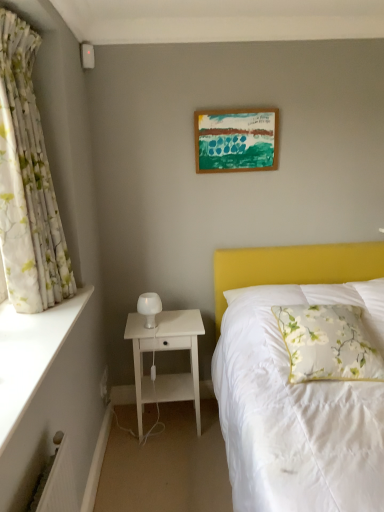
The height and width of the screenshot is (512, 384). Describe the element at coordinates (166, 350) in the screenshot. I see `white wood nightstand at lower left` at that location.

This screenshot has width=384, height=512. Identify the location of floral fabric pillow at right. (328, 343).

The image size is (384, 512). Identify the location of white floral fabric curtain at left. coord(27,182).

This screenshot has height=512, width=384. I want to click on ledge that appears above the white wood nightstand at lower left (from a real-world perspective), so click(30, 354).

Between white smooth ledge at left and white wood nightstand at lower left, which one has smaller size?

With smaller size is white smooth ledge at left.

In the image, is white smooth ledge at left positioned in front of or behind white wood nightstand at lower left?

white smooth ledge at left is in front of white wood nightstand at lower left.

Can you confirm if white smooth ledge at left is thinner than white wood nightstand at lower left?

Yes.

Is white frosted glass table lamp at left aimed at floral fabric pillow at right?

No, white frosted glass table lamp at left is not facing towards floral fabric pillow at right.

Is white frosted glass table lamp at left taller or shorter than floral fabric pillow at right?

In the image, white frosted glass table lamp at left appears to be shorter than floral fabric pillow at right.

Between white frosted glass table lamp at left and floral fabric pillow at right, which one appears on the right side from the viewer's perspective?

From the viewer's perspective, floral fabric pillow at right appears more on the right side.

Does point (140, 302) come farther from viewer compared to point (311, 374)?

That is True.

Is white floral fabric curtain at left oriented towards white smooth ledge at left?

No, white floral fabric curtain at left is not facing towards white smooth ledge at left.

Which object is further away from the camera, white floral fabric curtain at left or white smooth ledge at left?

Positioned behind is white floral fabric curtain at left.

From a real-world perspective, who is located lower, white floral fabric curtain at left or white smooth ledge at left?

white smooth ledge at left is physically lower.

Considering the positions of objects white floral fabric curtain at left and white smooth ledge at left in the image provided, who is more to the left, white floral fabric curtain at left or white smooth ledge at left?

white floral fabric curtain at left is more to the left.

Which object is closer to the camera taking this photo, white frosted glass table lamp at left or white wood nightstand at lower left?

white wood nightstand at lower left is closer to the camera.

Does point (146, 300) come farther from viewer compared to point (194, 380)?

No, it is in front of (194, 380).

Is white frosted glass table lamp at left spatially inside white wood nightstand at lower left, or outside of it?

white frosted glass table lamp at left is spatially situated outside white wood nightstand at lower left.

From a real-world perspective, who is located lower, white frosted glass table lamp at left or white wood nightstand at lower left?

white wood nightstand at lower left.

How distant is white frosted glass table lamp at left from white smooth ledge at left?

A distance of 32.56 inches exists between white frosted glass table lamp at left and white smooth ledge at left.

Consider the image. Considering the positions of objects white frosted glass table lamp at left and white smooth ledge at left in the image provided, who is in front, white frosted glass table lamp at left or white smooth ledge at left?

white smooth ledge at left.

Which is correct: white frosted glass table lamp at left is inside white smooth ledge at left, or outside of it?

white frosted glass table lamp at left is located beyond the bounds of white smooth ledge at left.

Is the depth of white smooth ledge at left less than that of wooden picture frame at upper center?

Yes, white smooth ledge at left is in front of wooden picture frame at upper center.

At what (x,y) coordinates should I click in order to perform the action: click on ledge below the wooden picture frame at upper center (from the image's perspective). Please return your answer as a coordinate pair (x, y). The width and height of the screenshot is (384, 512). Looking at the image, I should click on (30, 354).

Is white smooth ledge at left aimed at wooden picture frame at upper center?

No, white smooth ledge at left is not turned towards wooden picture frame at upper center.

Is wooden picture frame at upper center surrounded by white smooth ledge at left?

Actually, wooden picture frame at upper center is outside white smooth ledge at left.

Is white wood nightstand at lower left at the right side of white floral fabric curtain at left?

Indeed, white wood nightstand at lower left is positioned on the right side of white floral fabric curtain at left.

In the scene shown: Could you tell me if white wood nightstand at lower left is turned towards white floral fabric curtain at left?

No, white wood nightstand at lower left is not turned towards white floral fabric curtain at left.

Does white wood nightstand at lower left come behind white floral fabric curtain at left?

That is True.

Based on the photo, from the image's perspective, between white wood nightstand at lower left and white floral fabric curtain at left, who is located below?

white wood nightstand at lower left is shown below in the image.

Identify the location of ledge that is above the white wood nightstand at lower left (from a real-world perspective). (30, 354).

Image resolution: width=384 pixels, height=512 pixels. I want to click on pillow to the right of white frosted glass table lamp at left, so click(x=328, y=343).

Based on the photo, which object lies further to the anchor point white wood nightstand at lower left, white floral fabric curtain at left or white frosted glass table lamp at left?

Among the two, white floral fabric curtain at left is located further to white wood nightstand at lower left.

Consider the image. Estimate the real-world distances between objects in this image. Which object is further from white frosted glass table lamp at left, white smooth ledge at left or white wood nightstand at lower left?

Based on the image, white smooth ledge at left appears to be further to white frosted glass table lamp at left.

When comparing their distances from white wood nightstand at lower left, does floral fabric pillow at right or white frosted glass table lamp at left seem closer?

white frosted glass table lamp at left lies closer to white wood nightstand at lower left than the other object.

Estimate the real-world distances between objects in this image. Which object is closer to wooden picture frame at upper center, white frosted glass table lamp at left or white smooth ledge at left?

Among the two, white frosted glass table lamp at left is located nearer to wooden picture frame at upper center.

Based on the photo, considering their positions, is white smooth ledge at left positioned further to white wood nightstand at lower left than white floral fabric curtain at left?

white floral fabric curtain at left.

From the image, which object appears to be nearer to white frosted glass table lamp at left, white wood nightstand at lower left or floral fabric pillow at right?

Among the two, white wood nightstand at lower left is located nearer to white frosted glass table lamp at left.

Estimate the real-world distances between objects in this image. Which object is further from white smooth ledge at left, floral fabric pillow at right or white wood nightstand at lower left?

Result: floral fabric pillow at right is positioned further to the anchor white smooth ledge at left.

Estimate the real-world distances between objects in this image. Which object is closer to wooden picture frame at upper center, white frosted glass table lamp at left or white wood nightstand at lower left?

Among the two, white frosted glass table lamp at left is located nearer to wooden picture frame at upper center.

Find the location of a particular element. The height and width of the screenshot is (512, 384). curtain between wooden picture frame at upper center and white wood nightstand at lower left in the vertical direction is located at coordinates (27, 182).

Where is `table lamp between white smooth ledge at left and wooden picture frame at upper center in the front-back direction`? table lamp between white smooth ledge at left and wooden picture frame at upper center in the front-back direction is located at coordinates (149, 307).

The height and width of the screenshot is (512, 384). Find the location of `curtain positioned between white smooth ledge at left and white wood nightstand at lower left from near to far`. curtain positioned between white smooth ledge at left and white wood nightstand at lower left from near to far is located at coordinates (27, 182).

Where is `nightstand located between white smooth ledge at left and white frosted glass table lamp at left in the depth direction`? This screenshot has height=512, width=384. nightstand located between white smooth ledge at left and white frosted glass table lamp at left in the depth direction is located at coordinates (166, 350).